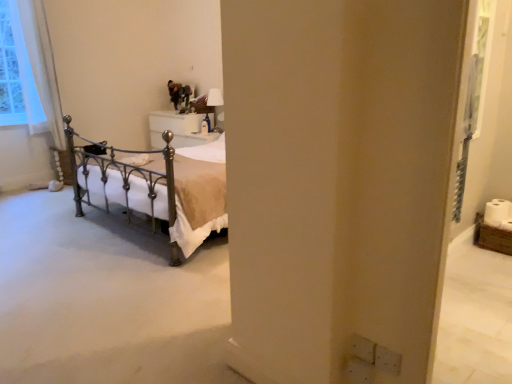
Question: Considering the relative positions of white sheer curtain at left and white glossy lampshade at upper center in the image provided, is white sheer curtain at left to the right of white glossy lampshade at upper center from the viewer's perspective?

Choices:
 (A) no
 (B) yes

Answer: (A)

Question: Is white sheer curtain at left outside white glossy lampshade at upper center?

Choices:
 (A) yes
 (B) no

Answer: (A)

Question: Does white sheer curtain at left come behind white glossy lampshade at upper center?

Choices:
 (A) yes
 (B) no

Answer: (B)

Question: Is white sheer curtain at left positioned before white glossy lampshade at upper center?

Choices:
 (A) no
 (B) yes

Answer: (B)

Question: Is white sheer curtain at left wider than white glossy lampshade at upper center?

Choices:
 (A) yes
 (B) no

Answer: (A)

Question: Considering the relative sizes of white sheer curtain at left and white glossy lampshade at upper center in the image provided, is white sheer curtain at left thinner than white glossy lampshade at upper center?

Choices:
 (A) yes
 (B) no

Answer: (B)

Question: Could you tell me if white sheer curtain at left is facing white glossy nightstand at center?

Choices:
 (A) no
 (B) yes

Answer: (A)

Question: Is white sheer curtain at left taller than white glossy nightstand at center?

Choices:
 (A) yes
 (B) no

Answer: (A)

Question: Is white glossy nightstand at center a part of white sheer curtain at left?

Choices:
 (A) no
 (B) yes

Answer: (A)

Question: From the image's perspective, is white sheer curtain at left on top of white glossy nightstand at center?

Choices:
 (A) no
 (B) yes

Answer: (B)

Question: Can you confirm if white sheer curtain at left is positioned to the right of white glossy nightstand at center?

Choices:
 (A) no
 (B) yes

Answer: (A)

Question: From a real-world perspective, does white sheer curtain at left stand above white glossy nightstand at center?

Choices:
 (A) yes
 (B) no

Answer: (A)

Question: Considering the relative positions of white glossy nightstand at center and white sheer curtain at left in the image provided, is white glossy nightstand at center to the right of white sheer curtain at left from the viewer's perspective?

Choices:
 (A) yes
 (B) no

Answer: (A)